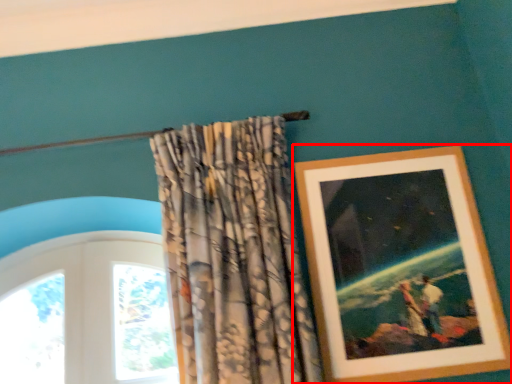
Question: Observing the image, what is the correct spatial positioning of picture frame (annotated by the red box) in reference to curtain?

Choices:
 (A) left
 (B) right

Answer: (B)